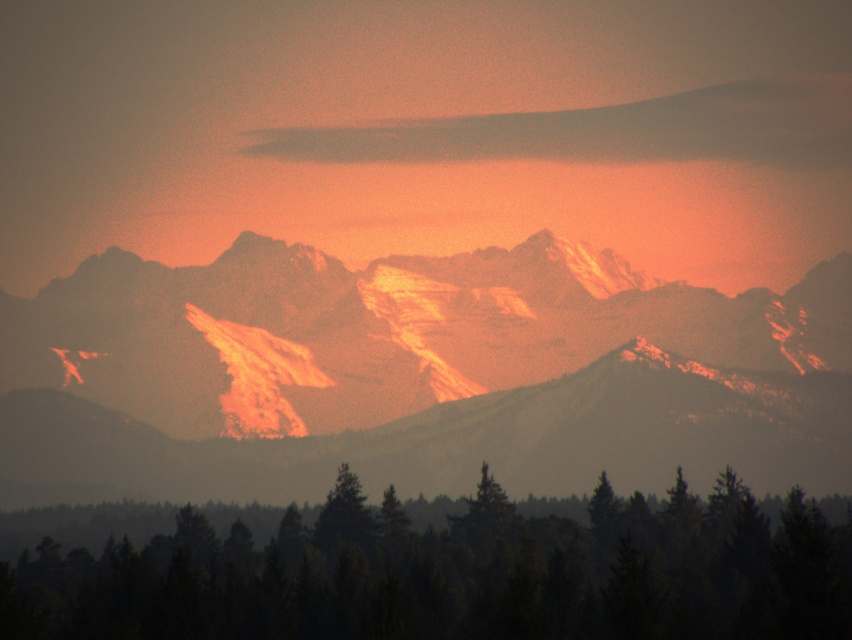
You are an outdoor enthusiast planning a hike and see the image. You want to know if the green matte pine forest at lower center is between you and the smokey gray cloud at upper center. Can you determine this based on the image?

The green matte pine forest at lower center is below the smokey gray cloud at upper center, so yes, the green matte pine forest at lower center is between you and the smokey gray cloud at upper center.

You are a hiker planning to take a photo of the smokey gray cloud at upper center and the green matte tree at center from your current position. Which object will appear closer to you in the photo?

The smokey gray cloud at upper center will appear closer to you in the photo because it is further to the viewer than the green matte tree at center.

You are an astronomer observing the sky in the scene. You notice a smokey gray cloud at upper center. Where exactly is it located in terms of coordinates?

The smokey gray cloud at upper center is located at point coordinates of [608,131].